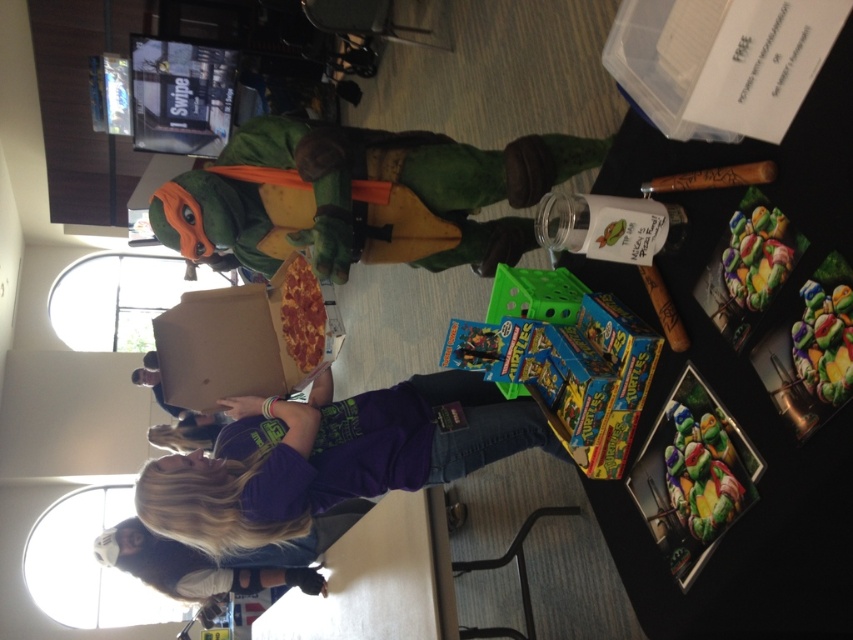
You are a child who wants to reach the blue cardboard toy at center from where you are standing. The adult holding it is 1.38 meters away. If you can jump 1 meter, can you reach it?

The blue cardboard toy at center is 1.38 meters away from you. Since you can only jump 1 meter, you cannot reach it without assistance.

You are standing at the origin point in the image. Which of the two points, point [572,364] or point [834,307], is closer to you?

Point [834,307] is closer to you because it is in front of point [572,364].